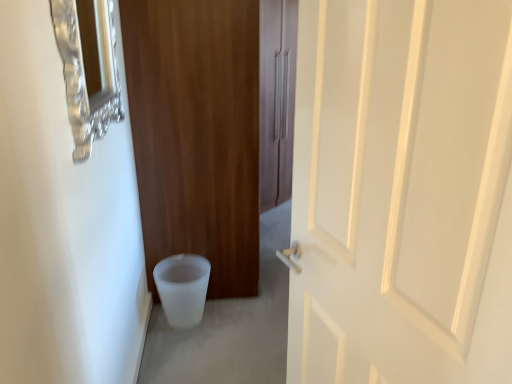
Question: Considering the positions of point click(x=72, y=107) and point click(x=164, y=309), is point click(x=72, y=107) closer or farther from the camera than point click(x=164, y=309)?

Choices:
 (A) closer
 (B) farther

Answer: (A)

Question: Relative to white frosted toilet bowl at lower left, is brushed metal medicine cabinet at upper left in front or behind?

Choices:
 (A) behind
 (B) front

Answer: (B)

Question: Which object is the farthest from the brushed metal medicine cabinet at upper left?

Choices:
 (A) matte wood door at center, acting as the second door starting from the front
 (B) white frosted toilet bowl at lower left
 (C) white matte door at center, the 1th door from the front

Answer: (B)

Question: Based on their relative distances, which object is nearer to the white frosted toilet bowl at lower left?

Choices:
 (A) brushed metal medicine cabinet at upper left
 (B) white matte door at center, which is the 2th door from back to front
 (C) matte wood door at center, acting as the second door starting from the front

Answer: (C)